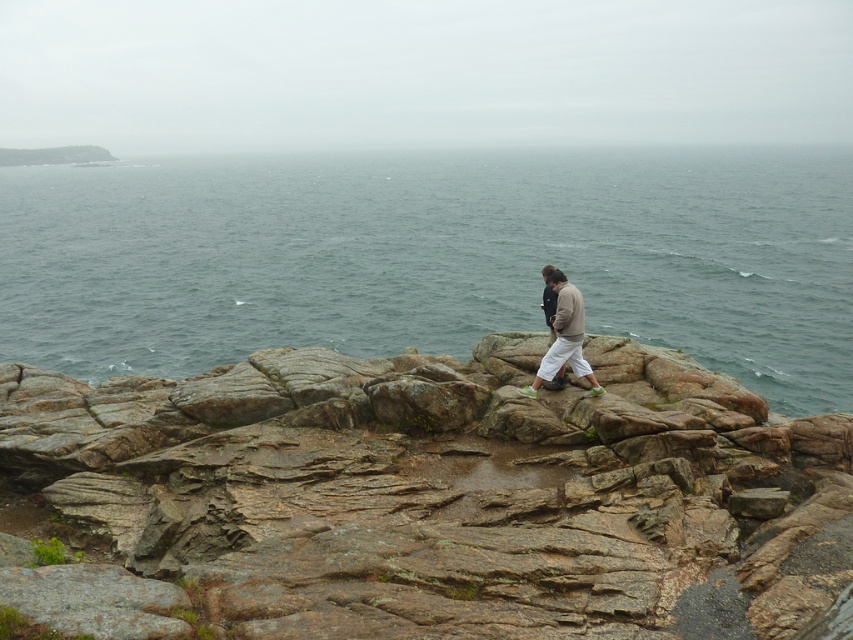
You are standing at point (537,380) and want to move towards point (378,435). Given the rocky terrain described in the scene, is the path between these two points likely to be stable enough for walking?

Point (378,435) is in front of point (537,380). The path between these points is likely stable for walking as the rocky terrain described has rugged layered rocks with weathering and moss growth, suggesting they have been in place long enough to form stable surfaces.